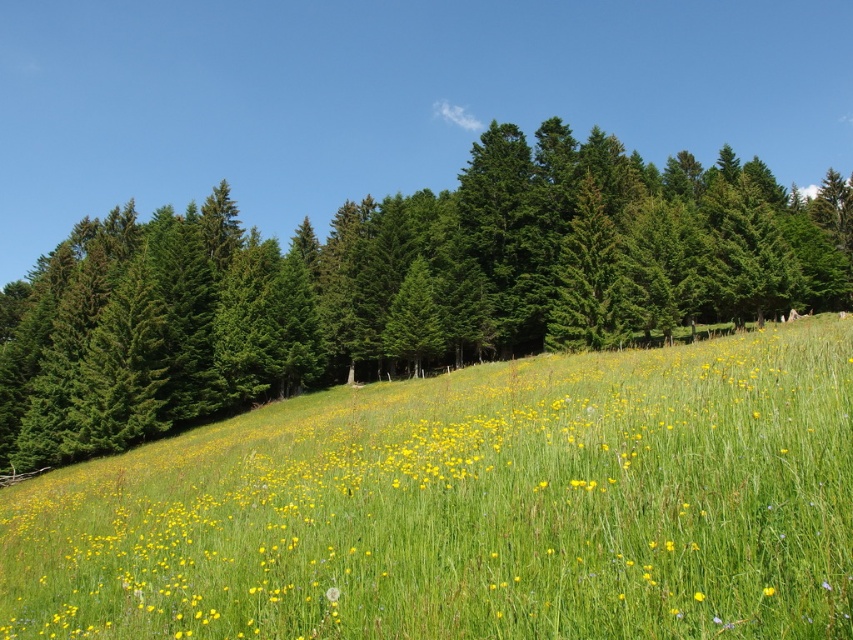
Does yellow grass at center have a lesser width compared to green textured pine forest at upper center?

Indeed, yellow grass at center has a lesser width compared to green textured pine forest at upper center.

Which is in front, point (80, 474) or point (68, 257)?

Positioned in front is point (80, 474).

Is point (426, 416) closer to viewer compared to point (828, 291)?

Yes, it is.

This screenshot has height=640, width=853. Identify the location of yellow grass at center. (473, 506).

Between green textured pine forest at upper center and yellow matte flower at center, which one has more height?

With more height is green textured pine forest at upper center.

Does green textured pine forest at upper center lie in front of yellow matte flower at center?

No, green textured pine forest at upper center is behind yellow matte flower at center.

The height and width of the screenshot is (640, 853). What are the coordinates of `green textured pine forest at upper center` in the screenshot? It's located at (401, 285).

Does point (492, 401) come behind point (764, 586)?

Yes, it is behind point (764, 586).

Is yellow grass at center below yellow matte flower at center?

Yes, yellow grass at center is below yellow matte flower at center.

Describe the element at coordinates (473, 506) in the screenshot. I see `yellow grass at center` at that location.

Identify the location of yellow grass at center. Image resolution: width=853 pixels, height=640 pixels. (473, 506).